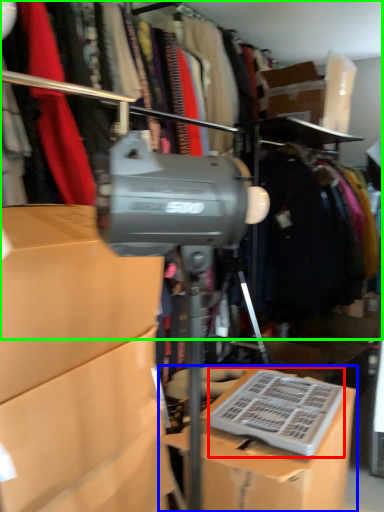
Question: Based on their relative distances, which object is nearer to wide (highlighted by a red box)? Choose from box (highlighted by a blue box) and closet (highlighted by a green box).

Choices:
 (A) box
 (B) closet

Answer: (A)